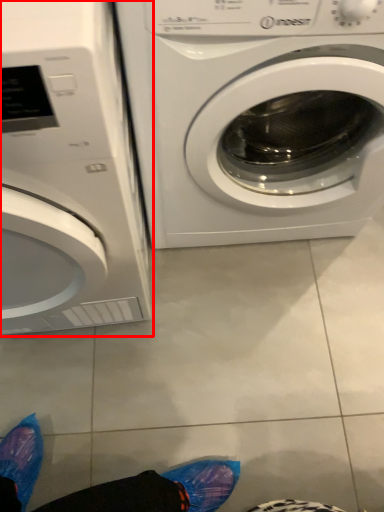
Question: From the image, what is the correct spatial relationship of washing machine (annotated by the red box) in relation to washing machine?

Choices:
 (A) right
 (B) left

Answer: (B)